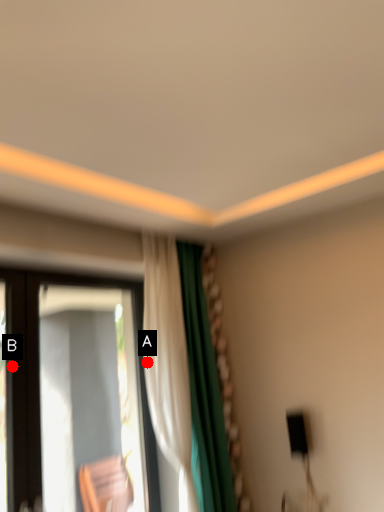
Question: Two points are circled on the image, labeled by A and B beside each circle. Which of the following is the farthest from the observer?

Choices:
 (A) A is further
 (B) B is further

Answer: (A)